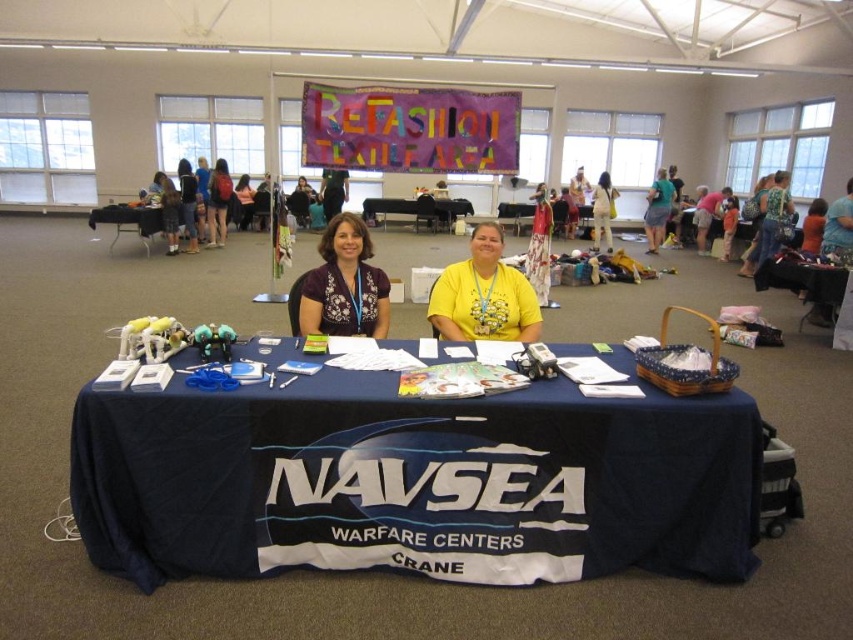
Question: Which point is closer to the camera taking this photo?

Choices:
 (A) (437, 444)
 (B) (440, 208)
 (C) (358, 289)

Answer: (A)

Question: Does blue fabric table at center appear on the right side of matte black backpack at center?

Choices:
 (A) yes
 (B) no

Answer: (A)

Question: Which point is farther to the camera?

Choices:
 (A) yellow matte shirt at center
 (B) matte purple blouse at center
 (C) black plastic table at center
 (D) matte black backpack at center

Answer: (C)

Question: Is matte purple blouse at center to the left of matte green skirt at center from the viewer's perspective?

Choices:
 (A) no
 (B) yes

Answer: (B)

Question: Which object appears farthest from the camera in this image?

Choices:
 (A) blue fabric table at center
 (B) matte black backpack at center

Answer: (B)

Question: Does yellow matte shirt at center appear over white cotton dress at upper center?

Choices:
 (A) no
 (B) yes

Answer: (A)